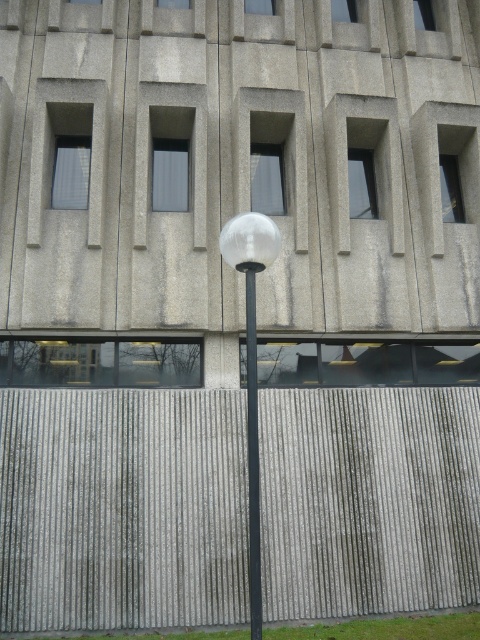
Who is higher up, transparent glass street light at center or polished glass pole at center?

transparent glass street light at center is above.

Does transparent glass street light at center appear on the left side of polished glass pole at center?

Indeed, transparent glass street light at center is positioned on the left side of polished glass pole at center.

Is point (247, 284) positioned behind point (252, 552)?

Yes, it is behind point (252, 552).

The height and width of the screenshot is (640, 480). Identify the location of transparent glass street light at center. (252, 365).